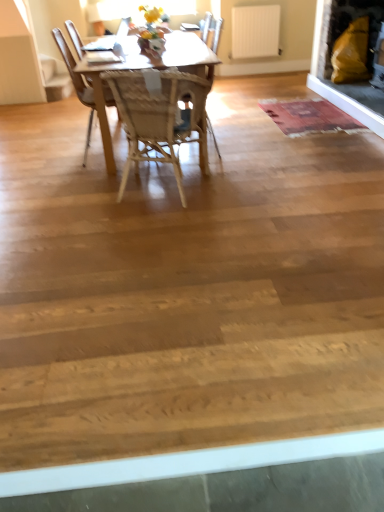
Locate an element on the screen. vacant area that lies to the right of wooden chair at center, marked as the second chair in a front-to-back arrangement is located at coordinates (257, 142).